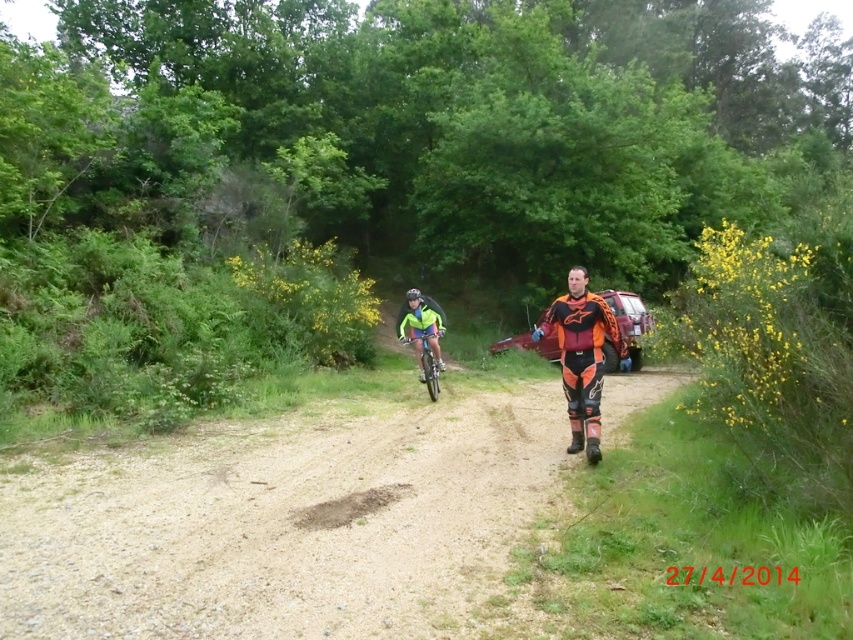
You are standing at the starting point of the mountain biking trail and see two points marked on the path ahead. The first point is at coordinates point (579, 332) and the second point is at coordinates point (428, 380). Which of these two points is closer to you?

Point (579, 332) is closer to the camera than point (428, 380), so the first point is closer to you.